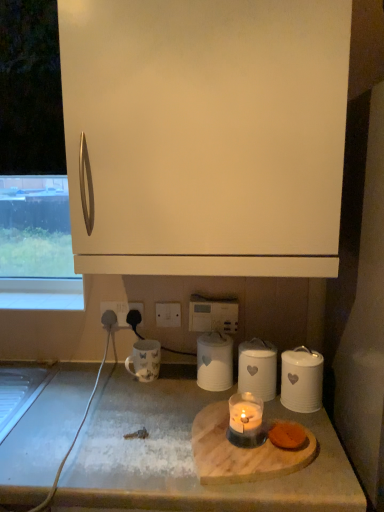
Where is `free region on the left part of white glossy mug at lower left`? This screenshot has height=512, width=384. free region on the left part of white glossy mug at lower left is located at coordinates (112, 379).